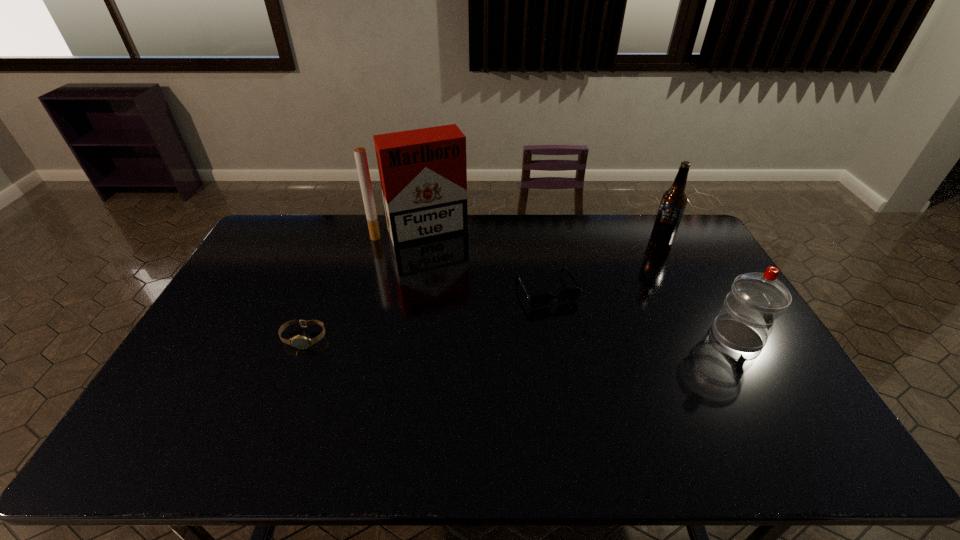
The width and height of the screenshot is (960, 540). I want to click on vacant point that satisfies the following two spatial constraints: 1. on the front side of the third shortest object; 2. on the handle side of the cigarette case, so click(x=402, y=336).

The height and width of the screenshot is (540, 960). I want to click on blank space that satisfies the following two spatial constraints: 1. on the back side of the third object from right to left; 2. on the left side of the beer bottle, so click(x=539, y=241).